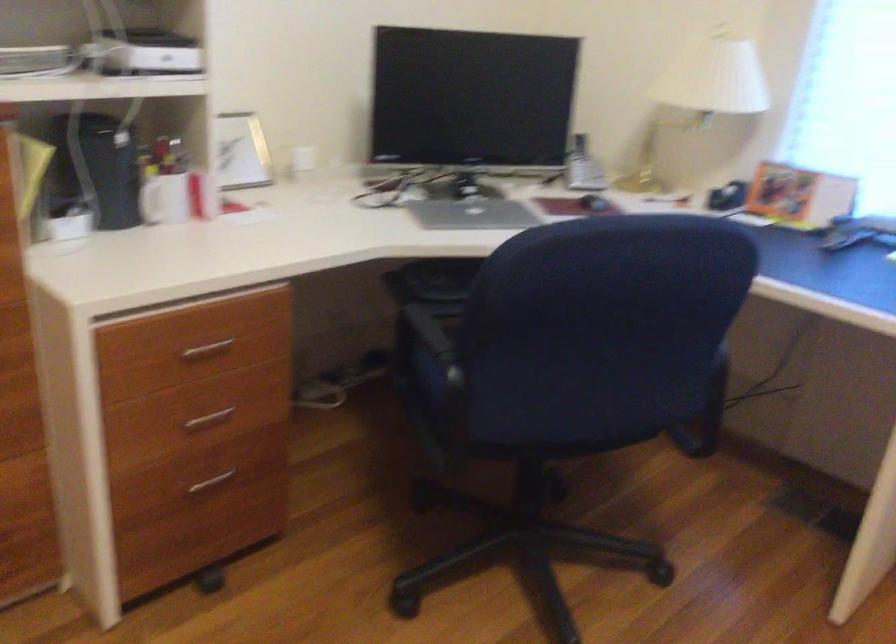
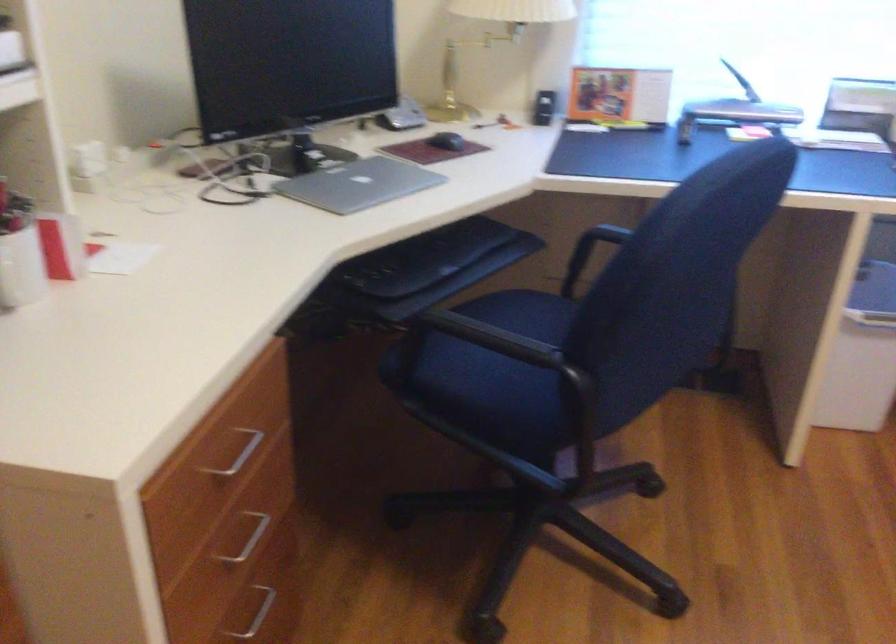
Find the pixel in the second image that matches the point at 216,482 in the first image.

(254, 612)